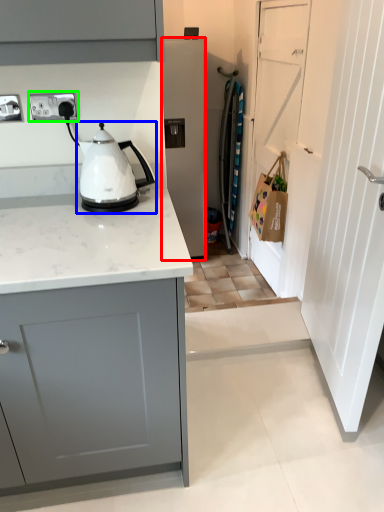
Question: Based on their relative distances, which object is nearer to home appliance (highlighted by a red box)? Choose from kitchen appliance (highlighted by a blue box) and electric outlet (highlighted by a green box).

Choices:
 (A) kitchen appliance
 (B) electric outlet

Answer: (A)